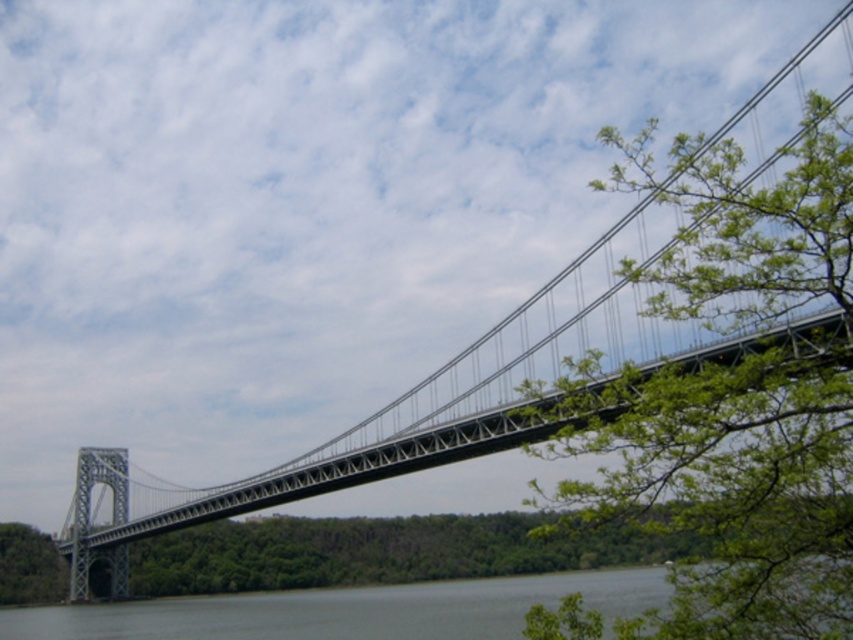
You are standing at point (735, 394) on the suspension bridge. What do you see directly in front of you?

At point (735, 394) lies green leafy tree at upper right, so you see the green leafy tree at upper right directly in front of you.

You are a photographer standing at the base of the suspension bridge. You want to capture a photo that includes both the greenish water at center and the green leafy tree at lower left. Which object should you adjust your camera angle to focus on first to ensure both are in the frame?

The greenish water at center is taller than the green leafy tree at lower left, so you should focus on the greenish water at center first to ensure both are in the frame.